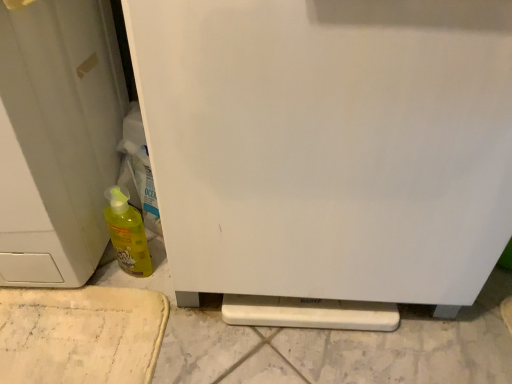
Question: From the image's perspective, is white matte door at left located beneath yellow translucent bottle at lower left?

Choices:
 (A) yes
 (B) no

Answer: (B)

Question: Can you confirm if white matte door at left is bigger than yellow translucent bottle at lower left?

Choices:
 (A) yes
 (B) no

Answer: (A)

Question: Can you confirm if white matte door at left is positioned to the left of yellow translucent bottle at lower left?

Choices:
 (A) yes
 (B) no

Answer: (A)

Question: Can you confirm if white matte door at left is positioned to the right of yellow translucent bottle at lower left?

Choices:
 (A) no
 (B) yes

Answer: (A)

Question: From the image's perspective, is white matte door at left above yellow translucent bottle at lower left?

Choices:
 (A) no
 (B) yes

Answer: (B)

Question: Is white matte door at left far away from yellow translucent bottle at lower left?

Choices:
 (A) yes
 (B) no

Answer: (B)

Question: From the image's perspective, would you say white matte refrigerator at center is shown under yellow translucent bottle at lower left?

Choices:
 (A) yes
 (B) no

Answer: (B)

Question: Would you say white matte refrigerator at center is outside yellow translucent bottle at lower left?

Choices:
 (A) yes
 (B) no

Answer: (A)

Question: Is yellow translucent bottle at lower left inside white matte refrigerator at center?

Choices:
 (A) no
 (B) yes

Answer: (A)

Question: Is white matte refrigerator at center wider than yellow translucent bottle at lower left?

Choices:
 (A) yes
 (B) no

Answer: (A)

Question: Is white matte refrigerator at center behind yellow translucent bottle at lower left?

Choices:
 (A) no
 (B) yes

Answer: (A)

Question: Does white matte refrigerator at center have a greater height compared to yellow translucent bottle at lower left?

Choices:
 (A) no
 (B) yes

Answer: (B)

Question: Is yellow translucent bottle at lower left far from white matte door at left?

Choices:
 (A) no
 (B) yes

Answer: (A)